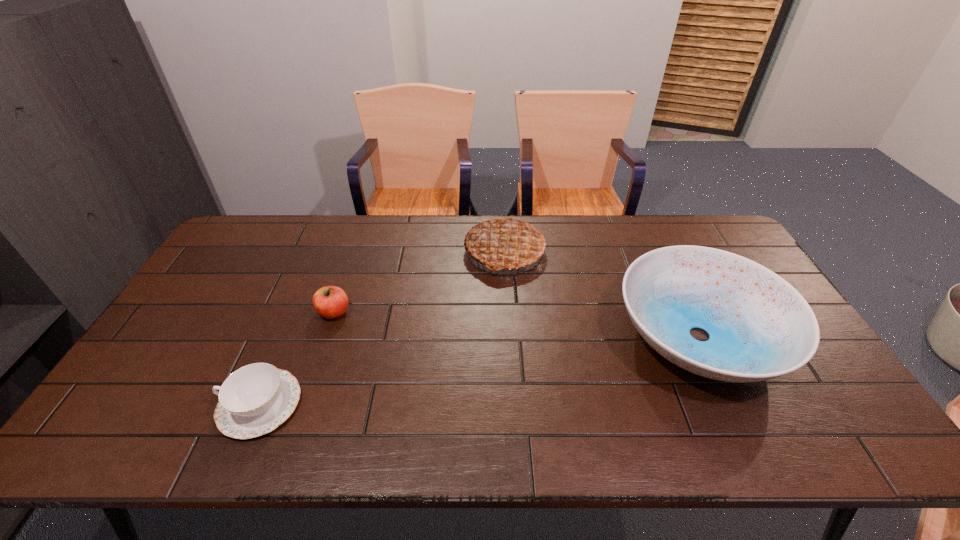
This screenshot has height=540, width=960. I want to click on free space between the shortest object and the pie, so click(x=382, y=328).

Identify the location of vacant point located between the chinaware and the pie. This screenshot has height=540, width=960. (382, 328).

Where is `free space between the second tallest object and the shortest object`? free space between the second tallest object and the shortest object is located at coordinates (480, 370).

Locate an element on the screen. free space between the chinaware and the pie is located at coordinates (382, 328).

The width and height of the screenshot is (960, 540). In order to click on empty location between the pie and the shortest object in this screenshot , I will do `click(382, 328)`.

Where is `free spot between the chinaware and the second shortest object`? The height and width of the screenshot is (540, 960). free spot between the chinaware and the second shortest object is located at coordinates (298, 359).

Where is `vacant area between the third tallest object and the chinaware`? vacant area between the third tallest object and the chinaware is located at coordinates (298, 359).

This screenshot has height=540, width=960. What are the coordinates of `free space between the dish and the third tallest object` in the screenshot? It's located at (516, 324).

This screenshot has height=540, width=960. Find the location of `empty space between the second shortest object and the shortest object`. empty space between the second shortest object and the shortest object is located at coordinates (298, 359).

Select which object appears as the second closest to the pie. Please provide its 2D coordinates. Your answer should be formatted as a tuple, i.e. [(x, y)], where the tuple contains the x and y coordinates of a point satisfying the conditions above.

[(330, 302)]